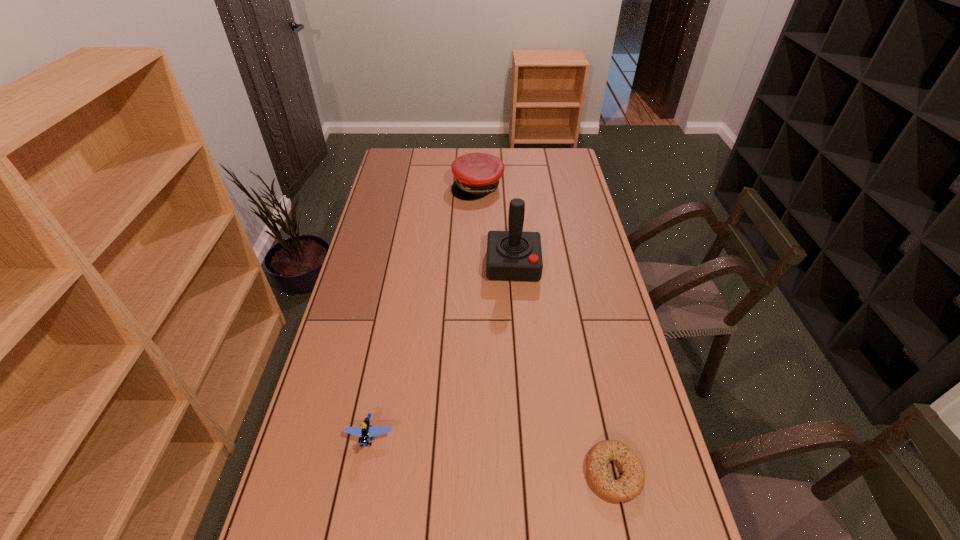
Image resolution: width=960 pixels, height=540 pixels. In order to click on free space on the desktop that is between the second shortest object and the bagel and is positioned at the front of the cap where the visor is located in this screenshot , I will do `click(524, 460)`.

This screenshot has height=540, width=960. What are the coordinates of `vacant space on the desktop that is between the leftmost object and the bagel and is positioned on the base of the tallest object` in the screenshot? It's located at (516, 458).